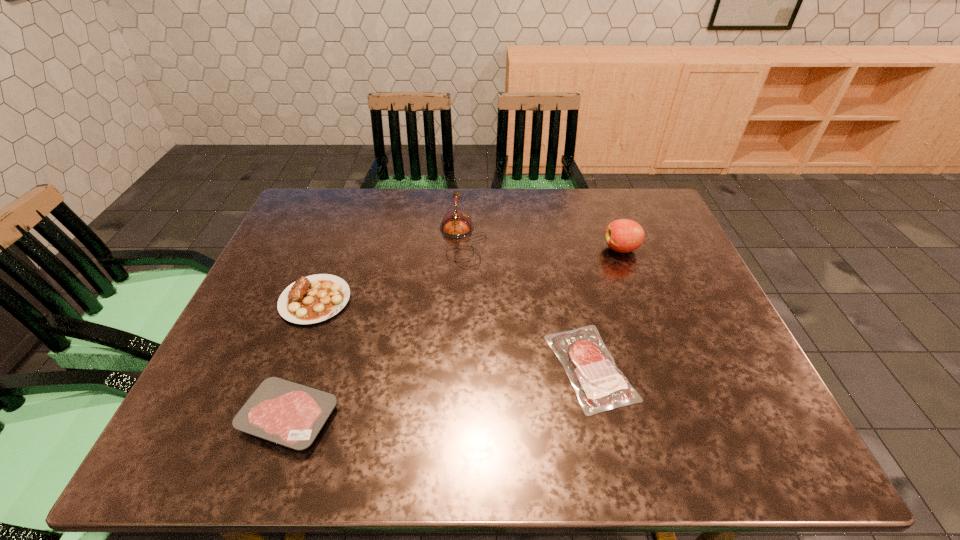
You are a GUI agent. You are given a task and a screenshot of the screen. Output one action in this format:
    pyautogui.click(x=<x>, y=<y>)
    Task: Click on the telephone
    This screenshot has height=540, width=960.
    Given the screenshot: What is the action you would take?
    pyautogui.click(x=456, y=223)

Where is `apple`? The height and width of the screenshot is (540, 960). apple is located at coordinates (624, 235).

Locate an element on the screen. The image size is (960, 540). the tallest steak is located at coordinates (312, 299).

Locate an element on the screen. Image resolution: width=960 pixels, height=540 pixels. the rightmost steak is located at coordinates (599, 384).

Locate an element on the screen. The width and height of the screenshot is (960, 540). free space located on the rotary dial of the telephone is located at coordinates (619, 240).

What are the coordinates of `free spot located 0.200m on the left of the apple` in the screenshot? It's located at (535, 249).

I want to click on free space located on the front of the third shortest object, so click(x=278, y=397).

The width and height of the screenshot is (960, 540). I want to click on free space located 0.350m on the left of the rightmost steak, so click(389, 367).

The width and height of the screenshot is (960, 540). Find the location of `object that is at the far edge`. object that is at the far edge is located at coordinates (456, 223).

Locate an element on the screen. object present at the near edge is located at coordinates (291, 414).